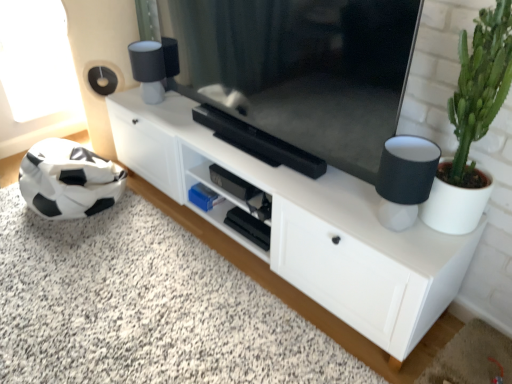
Question: Is black matte soccer ball at lower left at the back of green succulent at right?

Choices:
 (A) no
 (B) yes

Answer: (A)

Question: Is green succulent at right next to black matte soccer ball at lower left and touching it?

Choices:
 (A) yes
 (B) no

Answer: (B)

Question: Does green succulent at right appear on the left side of black matte soccer ball at lower left?

Choices:
 (A) yes
 (B) no

Answer: (B)

Question: Is green succulent at right at the right side of black matte soccer ball at lower left?

Choices:
 (A) no
 (B) yes

Answer: (B)

Question: From a real-world perspective, is green succulent at right positioned over black matte soccer ball at lower left based on gravity?

Choices:
 (A) yes
 (B) no

Answer: (A)

Question: Considering the positions of matte black television at center and black matte soccer ball at lower left in the image, is matte black television at center bigger or smaller than black matte soccer ball at lower left?

Choices:
 (A) big
 (B) small

Answer: (A)

Question: Does point (378, 66) appear closer or farther from the camera than point (232, 271)?

Choices:
 (A) closer
 (B) farther

Answer: (A)

Question: Is matte black television at center taller or shorter than black matte soccer ball at lower left?

Choices:
 (A) short
 (B) tall

Answer: (B)

Question: In the image, is matte black television at center on the left side or the right side of black matte soccer ball at lower left?

Choices:
 (A) right
 (B) left

Answer: (A)

Question: From a real-world perspective, is matte black television at center above or below black fabric lampshade at right?

Choices:
 (A) above
 (B) below

Answer: (A)

Question: Is matte black television at center to the left or to the right of black fabric lampshade at right in the image?

Choices:
 (A) right
 (B) left

Answer: (B)

Question: Looking at their shapes, would you say matte black television at center is wider or thinner than black fabric lampshade at right?

Choices:
 (A) thin
 (B) wide

Answer: (A)

Question: Is point (308, 13) positioned closer to the camera than point (428, 192)?

Choices:
 (A) farther
 (B) closer

Answer: (A)

Question: From the image's perspective, is green succulent at right located above or below white matte cabinet at center?

Choices:
 (A) below
 (B) above

Answer: (B)

Question: Is point (468, 74) positioned closer to the camera than point (180, 162)?

Choices:
 (A) closer
 (B) farther

Answer: (A)